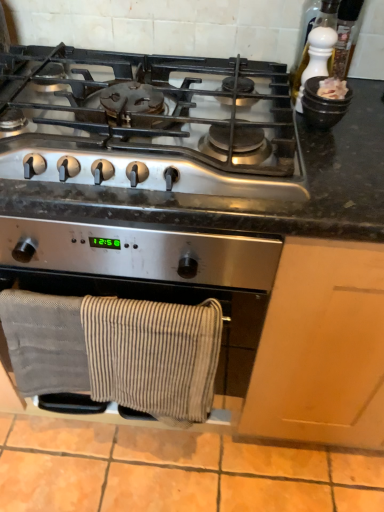
Question: Is white ceramic pepper grinder at upper right wider or thinner than satin silver gas stove at upper center?

Choices:
 (A) wide
 (B) thin

Answer: (B)

Question: Is point (309, 34) positioned closer to the camera than point (104, 106)?

Choices:
 (A) closer
 (B) farther

Answer: (B)

Question: Estimate the real-world distances between objects in this image. Which object is closer to the gray cotton towels at lower center?

Choices:
 (A) satin silver gas stove at upper center
 (B) white ceramic pepper grinder at upper right

Answer: (A)

Question: Which object is positioned closest to the white ceramic pepper grinder at upper right?

Choices:
 (A) gray cotton towels at lower center
 (B) satin silver gas stove at upper center

Answer: (B)